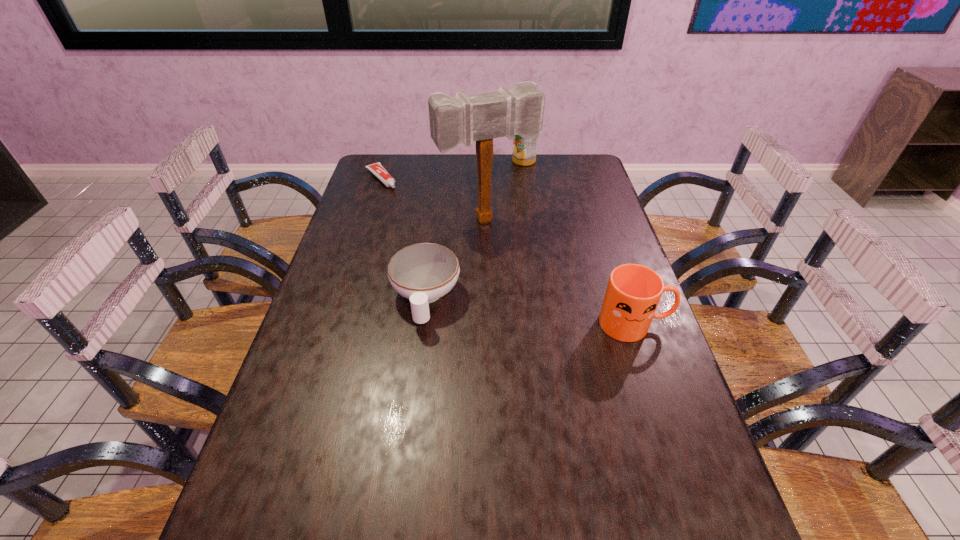
At what (x,y) coordinates should I click in order to perform the action: click on free space between the mallet and the third shortest object. Please return your answer as a coordinate pair (x, y). Looking at the image, I should click on (560, 272).

Where is `free spot between the fourth tallest object and the leftmost object`? Image resolution: width=960 pixels, height=540 pixels. free spot between the fourth tallest object and the leftmost object is located at coordinates (403, 239).

Identify the location of free space between the shortest object and the mug. (508, 251).

The image size is (960, 540). I want to click on free spot between the mallet and the fruit juice, so click(505, 190).

The image size is (960, 540). Find the location of `free area in between the second shortest object and the fourth nearest object`. free area in between the second shortest object and the fourth nearest object is located at coordinates (403, 239).

Where is `unoccupied area between the fourth shortest object and the fourth tallest object`? This screenshot has height=540, width=960. unoccupied area between the fourth shortest object and the fourth tallest object is located at coordinates (474, 230).

At what (x,y) coordinates should I click in order to perform the action: click on free spot between the toothpaste and the chinaware. Please return your answer as a coordinate pair (x, y). Looking at the image, I should click on (403, 239).

The width and height of the screenshot is (960, 540). Identify the location of unoccupied area between the shortest object and the second shortest object. pos(403,239).

Locate which object is the closest to the fruit juice. Please provide its 2D coordinates. Your answer should be formatted as a tuple, i.e. [(x, y)], where the tuple contains the x and y coordinates of a point satisfying the conditions above.

[(462, 119)]

Identify which object is the fourth closest to the third tallest object. Please provide its 2D coordinates. Your answer should be formatted as a tuple, i.e. [(x, y)], where the tuple contains the x and y coordinates of a point satisfying the conditions above.

[(377, 169)]